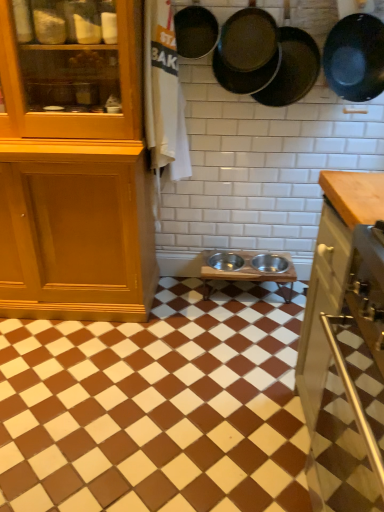
Question: From a real-world perspective, is dark brown matte frying pan at upper right, which is the third frying pan in right-to-left order, positioned above or below matte black frying pan at upper right, the second frying pan in the right-to-left sequence?

Choices:
 (A) below
 (B) above

Answer: (B)

Question: From the image's perspective, is dark brown matte frying pan at upper right, placed as the 2th frying pan when sorted from left to right, above or below matte black frying pan at upper right, the second frying pan in the right-to-left sequence?

Choices:
 (A) below
 (B) above

Answer: (B)

Question: Based on their relative distances, which object is nearer to the dark brown matte frying pan at upper right, placed as the 2th frying pan when sorted from left to right?

Choices:
 (A) matte black frying pan at upper center, the first frying pan viewed from the left
 (B) metallic silver bowls at center
 (C) matte black frying pan at upper right, which is counted as the 3th frying pan, starting from the left
 (D) black matte frying pan at upper right, which is the 1th frying pan from right to left

Answer: (C)

Question: Which object is the farthest from the matte black frying pan at upper right, which is counted as the 3th frying pan, starting from the left?

Choices:
 (A) dark brown matte frying pan at upper right, which is the third frying pan in right-to-left order
 (B) black matte frying pan at upper right, which is the 1th frying pan from right to left
 (C) matte black frying pan at upper center, the first frying pan viewed from the left
 (D) metallic silver bowls at center

Answer: (D)